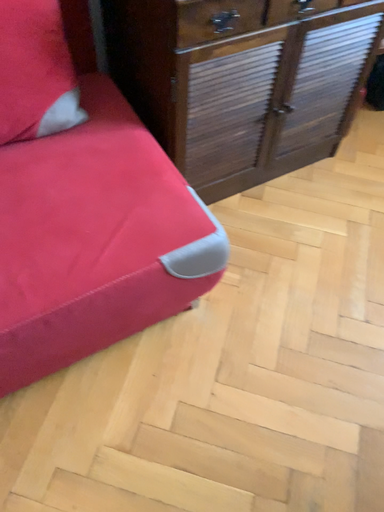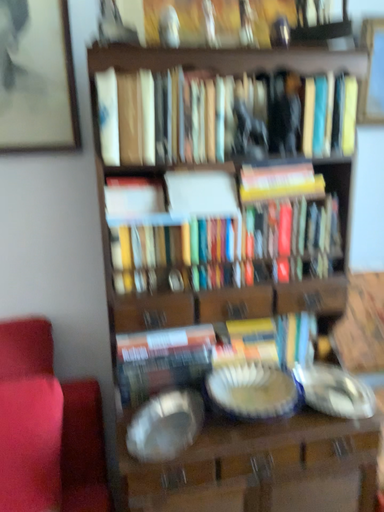
Question: Which way did the camera rotate in the video?

Choices:
 (A) rotated downward
 (B) rotated upward

Answer: (B)